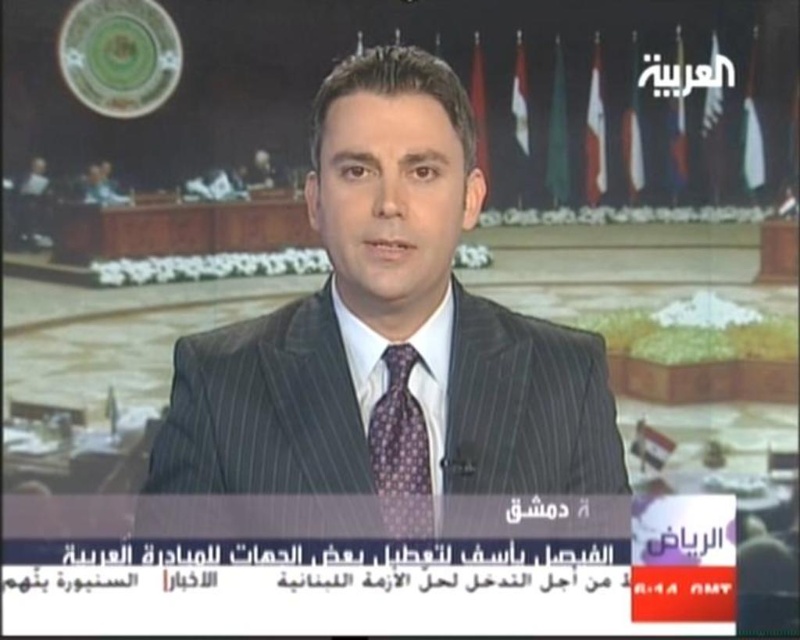
You are a fashion designer analyzing the attire of the speaker in the news broadcast. The speaker is wearing a dark gray pinstripe suit at center and a purple dotted tie at center. Which item is positioned higher on his body?

The dark gray pinstripe suit at center is located above the purple dotted tie at center, so the suit is positioned higher on his body.

You are a fashion designer analyzing the image of a man in a dark gray pinstripe suit at center and a purple dotted tie at center. Which item of clothing is larger in size?

The dark gray pinstripe suit at center is larger in size compared to the purple dotted tie at center.

You are a fashion designer observing the news broadcast scene. You notice the dark gray pinstripe suit at center and the purple dotted tie at center. Which clothing item is positioned closer to the camera?

The dark gray pinstripe suit at center is positioned closer to the camera than the purple dotted tie at center.